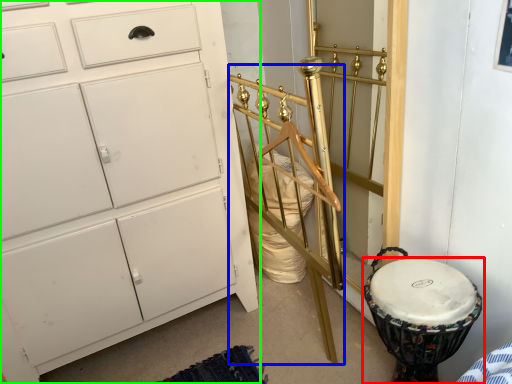
Question: Which object is positioned closest to drum (highlighted by a red box)? Select from bed frame (highlighted by a blue box) and chest of drawers (highlighted by a green box).

Choices:
 (A) bed frame
 (B) chest of drawers

Answer: (A)